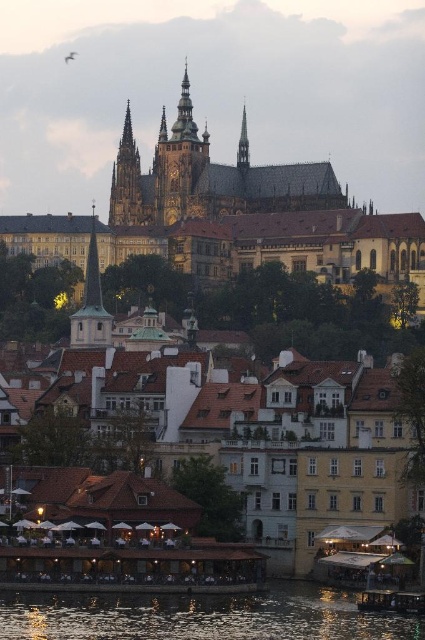
You are a tourist standing in front of the Prague Castle at dusk. You notice two spires in the image, the smooth white spire at left and the golden stone spire at upper center. Which spire is bigger in size?

The smooth white spire at left is larger in size compared to the golden stone spire at upper center.

You are standing at the lower center of the scene and want to cross to the golden stone spire at upper center. Given that the reflective glass water at lower center is wider than the spire, will you have enough space to walk around it?

The reflective glass water at lower center is wider than the golden stone spire at upper center, so there might not be enough space to walk around it directly. You may need to find an alternative path or navigate carefully around its edges.

You are an architect analyzing the Prague Castle area. You observe the golden stone spire at upper center and the smooth gold spire at upper center. Which one is positioned higher in the image?

The smooth gold spire at upper center is positioned higher in the image than the golden stone spire at upper center.